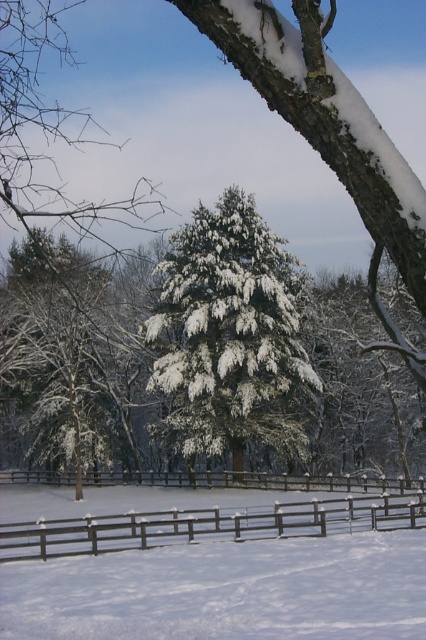
Between point (160, 355) and point (405, 524), which one is positioned behind?

Positioned behind is point (160, 355).

The width and height of the screenshot is (426, 640). What do you see at coordinates (230, 337) in the screenshot? I see `white fluffy tree at center` at bounding box center [230, 337].

What do you see at coordinates (230, 337) in the screenshot? I see `white fluffy tree at center` at bounding box center [230, 337].

The width and height of the screenshot is (426, 640). In order to click on white fluffy tree at center in this screenshot , I will do `click(230, 337)`.

Who is taller, brown wooden fence at lower center or brown wooden fence at center?

brown wooden fence at lower center

Does point (310, 534) come in front of point (336, 476)?

Yes, point (310, 534) is closer to viewer.

Is point (328, 518) closer to viewer compared to point (394, 483)?

Yes.

You are a GUI agent. You are given a task and a screenshot of the screen. Output one action in this format:
    pyautogui.click(x=<x>, y=<y>)
    Task: Click on the brown wooden fence at lower center
    The width and height of the screenshot is (426, 640).
    Given the screenshot: What is the action you would take?
    pyautogui.click(x=209, y=524)

Does white fluffy tree at center have a lesser width compared to brown wooden fence at center?

Indeed, white fluffy tree at center has a lesser width compared to brown wooden fence at center.

The image size is (426, 640). What do you see at coordinates (230, 337) in the screenshot? I see `white fluffy tree at center` at bounding box center [230, 337].

Identify the location of white fluffy tree at center. Image resolution: width=426 pixels, height=640 pixels. (230, 337).